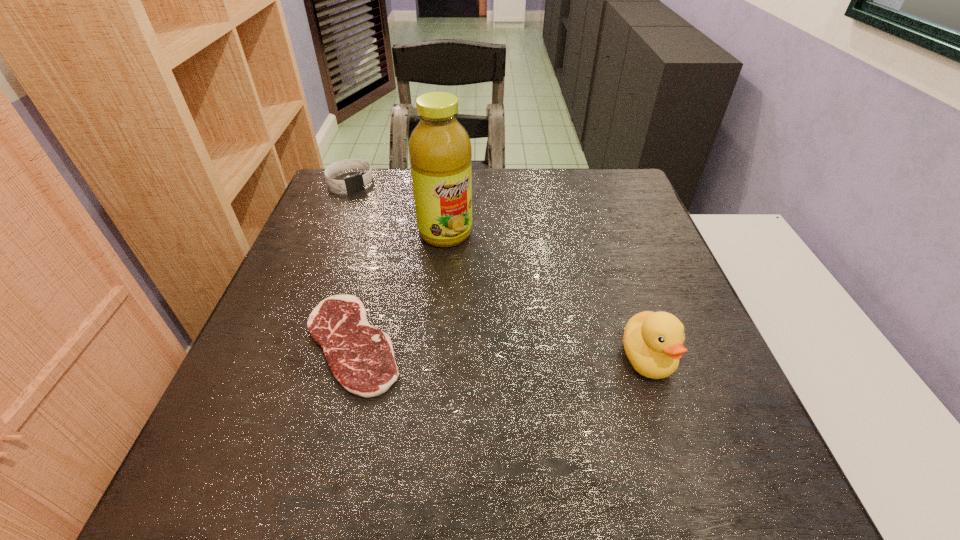
Identify the location of object present at the far left corner. (356, 182).

The image size is (960, 540). What are the coordinates of `object positioned at the near left corner` in the screenshot? It's located at (361, 357).

Where is `free location at the far edge`? free location at the far edge is located at coordinates (548, 168).

In the image, there is a desktop. Where is `vacant space at the near edge`? The height and width of the screenshot is (540, 960). vacant space at the near edge is located at coordinates (577, 411).

Identify the location of free spot at the right edge of the desktop. This screenshot has width=960, height=540. (626, 319).

Image resolution: width=960 pixels, height=540 pixels. Identify the location of blank area at the far left corner. (341, 192).

Locate an element on the screen. The width and height of the screenshot is (960, 540). vacant space at the far right corner of the desktop is located at coordinates (599, 189).

In order to click on vacant region at the near right corner of the desktop in this screenshot , I will do `click(659, 426)`.

This screenshot has height=540, width=960. I want to click on unoccupied position between the steak and the tallest object, so click(x=399, y=288).

At what (x,y) coordinates should I click in order to perform the action: click on unoccupied area between the steak and the fruit juice. Please return your answer as a coordinate pair (x, y). Looking at the image, I should click on (399, 288).